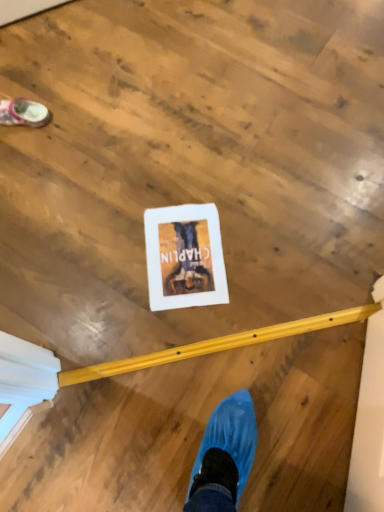
You are a GUI agent. You are given a task and a screenshot of the screen. Output one action in this format:
    pyautogui.click(x=<x>, y=<y>)
    Task: Click on the vacant area that lies to the right of white fabric shoe at upper left
    Image resolution: width=384 pixels, height=512 pixels.
    Given the screenshot: What is the action you would take?
    pyautogui.click(x=79, y=114)